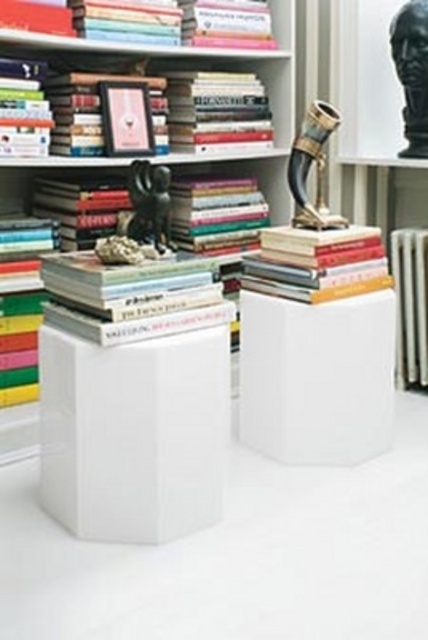
Is hardcover books at upper center positioned in front of hardcover books at center?

That is True.

What are the coordinates of `hardcover books at upper center` in the screenshot? It's located at (163, 109).

Who is shorter, white glossy bookcase at center or hardcover books at upper center?

With less height is hardcover books at upper center.

Is point (270, 8) positioned in front of point (160, 116)?

No, (270, 8) is behind (160, 116).

Who is more forward, [3,433] or [267,132]?

Point [3,433] is more forward.

You are a GUI agent. You are given a task and a screenshot of the screen. Output one action in this format:
    pyautogui.click(x=<x>, y=<y>)
    Task: Click on the white glossy bookcase at center
    This screenshot has height=640, width=428.
    Given the screenshot: What is the action you would take?
    pyautogui.click(x=208, y=68)

Who is more forward, (231, 147) or (306, 285)?

Point (306, 285)

Between point (244, 68) and point (312, 301), which one is positioned behind?

Point (244, 68)

Where is `white glossy bookcase at center`? white glossy bookcase at center is located at coordinates point(208,68).